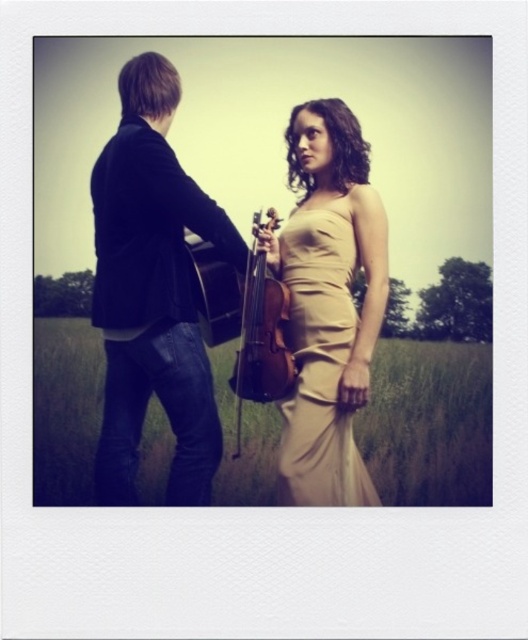
Between dark blue denim jeans at left and satin beige dress at center, which one is positioned higher?

Positioned higher is dark blue denim jeans at left.

Does dark blue denim jeans at left lie in front of satin beige dress at center?

Yes, dark blue denim jeans at left is in front of satin beige dress at center.

Which is behind, point (154, 352) or point (295, 298)?

The point (295, 298) is behind.

Where is `dark blue denim jeans at left`? dark blue denim jeans at left is located at coordinates (154, 291).

Looking at this image, can you confirm if beige silk dress at center is positioned to the right of satin beige dress at center?

In fact, beige silk dress at center is to the left of satin beige dress at center.

Is beige silk dress at center thinner than satin beige dress at center?

Indeed, beige silk dress at center has a lesser width compared to satin beige dress at center.

Identify the location of beige silk dress at center. The width and height of the screenshot is (528, 640). (429, 422).

Identify the location of beige silk dress at center. (429, 422).

Does point (478, 362) come in front of point (285, 314)?

That is False.

Can you confirm if beige silk dress at center is smaller than wooden violin at center?

Yes, beige silk dress at center is smaller than wooden violin at center.

Between point (394, 456) and point (286, 364), which one is positioned behind?

The point (394, 456) is more distant.

Where is `beige silk dress at center`? This screenshot has width=528, height=640. beige silk dress at center is located at coordinates (429, 422).